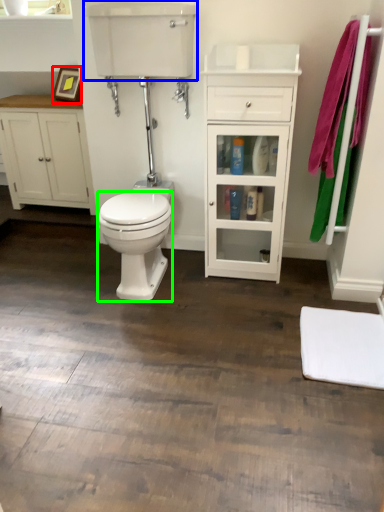
Question: Estimate the real-world distances between objects in this image. Which object is closer to picture frame (highlighted by a red box), sink (highlighted by a blue box) or bidet (highlighted by a green box)?

Choices:
 (A) sink
 (B) bidet

Answer: (A)